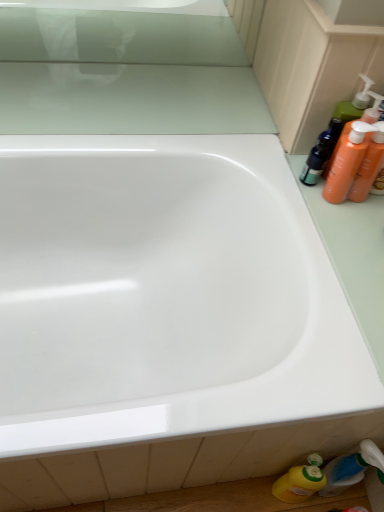
This screenshot has height=512, width=384. What are the coordinates of `yellow plastic bottle at lower right, which appears as the first cleaning product when ordered from the bottom` in the screenshot? It's located at (300, 481).

Measure the distance between white glossy bathtub at center and camera.

A distance of 59.92 centimeters exists between white glossy bathtub at center and camera.

In order to face orange plastic bottles at upper right, the 1th toiletry from the top, should I rotate leftwards or rightwards?

You should rotate right by 20.645 degrees.

The width and height of the screenshot is (384, 512). Identify the location of yellow plastic bottle at lower right, acting as the second cleaning product starting from the top. [x=300, y=481].

From a real-world perspective, is orange plastic bottles at right, positioned as the second toiletry in top-to-bottom order, located higher than translucent plastic bottle at lower right, the 1th toiletry from the bottom?

Indeed, from a real-world perspective, orange plastic bottles at right, positioned as the second toiletry in top-to-bottom order, stands above translucent plastic bottle at lower right, the 1th toiletry from the bottom.

Is point (367, 172) positioned before point (334, 476)?

Yes, point (367, 172) is in front of point (334, 476).

In the scene shown: Are orange plastic bottles at right, which ranks as the second toiletry in bottom-to-top order, and translucent plastic bottle at lower right, the 1th toiletry from the bottom, far apart?

That's not correct — orange plastic bottles at right, which ranks as the second toiletry in bottom-to-top order, is a little close to translucent plastic bottle at lower right, the 1th toiletry from the bottom.

From the image's perspective, does orange plastic bottles at right, positioned as the second toiletry in top-to-bottom order, appear lower than translucent plastic bottle at lower right, which ranks as the 3th toiletry in top-to-bottom order?

No.

Is orange plastic bottles at upper right, the third toiletry when ordered from bottom to top, facing away from orange plastic bottles at right, positioned as the second toiletry in top-to-bottom order?

No, orange plastic bottles at right, positioned as the second toiletry in top-to-bottom order, is not at the back of orange plastic bottles at upper right, the third toiletry when ordered from bottom to top.

Is orange plastic bottles at upper right, the 1th toiletry from the top, inside or outside of orange plastic bottles at right, which ranks as the second toiletry in bottom-to-top order?

orange plastic bottles at upper right, the 1th toiletry from the top, exists outside the volume of orange plastic bottles at right, which ranks as the second toiletry in bottom-to-top order.

From the picture: Relative to orange plastic bottles at right, positioned as the second toiletry in top-to-bottom order, is orange plastic bottles at upper right, the third toiletry when ordered from bottom to top, in front or behind?

orange plastic bottles at upper right, the third toiletry when ordered from bottom to top, is behind orange plastic bottles at right, positioned as the second toiletry in top-to-bottom order.

Looking at the image, does orange plastic bottles at right, positioned as the second toiletry in top-to-bottom order, seem bigger or smaller compared to yellow plastic bottle at lower right, which appears as the first cleaning product when ordered from the bottom?

orange plastic bottles at right, positioned as the second toiletry in top-to-bottom order, is smaller than yellow plastic bottle at lower right, which appears as the first cleaning product when ordered from the bottom.

Between orange plastic bottles at right, positioned as the second toiletry in top-to-bottom order, and yellow plastic bottle at lower right, which appears as the first cleaning product when ordered from the bottom, which one appears on the left side from the viewer's perspective?

yellow plastic bottle at lower right, which appears as the first cleaning product when ordered from the bottom, is more to the left.

How distant is orange plastic bottles at right, which ranks as the second toiletry in bottom-to-top order, from yellow plastic bottle at lower right, acting as the second cleaning product starting from the right?

orange plastic bottles at right, which ranks as the second toiletry in bottom-to-top order, is 25.72 inches from yellow plastic bottle at lower right, acting as the second cleaning product starting from the right.

Looking at this image, considering the relative sizes of orange plastic bottles at right, positioned as the second toiletry in top-to-bottom order, and yellow plastic bottle at lower right, acting as the second cleaning product starting from the top, in the image provided, is orange plastic bottles at right, positioned as the second toiletry in top-to-bottom order, shorter than yellow plastic bottle at lower right, acting as the second cleaning product starting from the top,?

Yes, orange plastic bottles at right, positioned as the second toiletry in top-to-bottom order, is shorter than yellow plastic bottle at lower right, acting as the second cleaning product starting from the top.

Which of these two, translucent plastic bottle at lower right, the 1th toiletry from the bottom, or white glossy bathtub at center, is thinner?

→ translucent plastic bottle at lower right, the 1th toiletry from the bottom, is thinner.

How many degrees apart are the facing directions of translucent plastic bottle at lower right, which ranks as the 3th toiletry in top-to-bottom order, and white glossy bathtub at center?

The angular difference between translucent plastic bottle at lower right, which ranks as the 3th toiletry in top-to-bottom order, and white glossy bathtub at center is 88.1 degrees.

Locate an element on the screen. the 2nd toiletry to the right of the white glossy bathtub at center, counting from the anchor's position is located at coordinates (351, 468).

From a real-world perspective, is translucent plastic bottle at lower right, which ranks as the 3th toiletry in top-to-bottom order, physically above white glossy bathtub at center?

No.

Can you tell me how much white glossy bathtub at center and orange plastic bottles at upper right, the 1th toiletry from the top, differ in facing direction?

The facing directions of white glossy bathtub at center and orange plastic bottles at upper right, the 1th toiletry from the top, are 87.4 degrees apart.

Is white glossy bathtub at center inside or outside of orange plastic bottles at upper right, the third toiletry when ordered from bottom to top?

white glossy bathtub at center exists outside the volume of orange plastic bottles at upper right, the third toiletry when ordered from bottom to top.

From a real-world perspective, is white glossy bathtub at center positioned above or below orange plastic bottles at upper right, the third toiletry when ordered from bottom to top?

Clearly, from a real-world perspective, white glossy bathtub at center is below orange plastic bottles at upper right, the third toiletry when ordered from bottom to top.

Is the depth of white glossy bathtub at center less than that of orange plastic bottles at upper right, the third toiletry when ordered from bottom to top?

Yes, the depth of white glossy bathtub at center is less than that of orange plastic bottles at upper right, the third toiletry when ordered from bottom to top.

Which object is more forward, orange plastic bottles at right, positioned as the second toiletry in top-to-bottom order, or white glossy bathtub at center?

white glossy bathtub at center.

Is orange plastic bottles at right, which ranks as the second toiletry in bottom-to-top order, oriented towards white glossy bathtub at center?

No, orange plastic bottles at right, which ranks as the second toiletry in bottom-to-top order, is not aimed at white glossy bathtub at center.

Between point (372, 162) and point (6, 261), which one is positioned in front?

The point (372, 162) is closer to the camera.

Looking at this image, between orange plastic bottles at right, which ranks as the second toiletry in bottom-to-top order, and white glossy bathtub at center, which one has larger size?

With larger size is white glossy bathtub at center.

From a real-world perspective, is orange plastic bottles at upper right, the first cleaning product positioned from the top, below orange plastic bottles at right, which ranks as the second toiletry in bottom-to-top order?

No, from a real-world perspective, orange plastic bottles at upper right, the first cleaning product positioned from the top, is not beneath orange plastic bottles at right, which ranks as the second toiletry in bottom-to-top order.

Is orange plastic bottles at upper right, marked as the 1th cleaning product in a right-to-left arrangement, taller than orange plastic bottles at right, which ranks as the second toiletry in bottom-to-top order?

Indeed, orange plastic bottles at upper right, marked as the 1th cleaning product in a right-to-left arrangement, has a greater height compared to orange plastic bottles at right, which ranks as the second toiletry in bottom-to-top order.

From the picture: Is orange plastic bottles at upper right, positioned as the 2th cleaning product in bottom-to-top order, to the left of orange plastic bottles at right, which ranks as the second toiletry in bottom-to-top order, from the viewer's perspective?

Yes.

Could you measure the distance between orange plastic bottles at upper right, the first cleaning product positioned from the top, and orange plastic bottles at right, positioned as the second toiletry in top-to-bottom order?

The distance of orange plastic bottles at upper right, the first cleaning product positioned from the top, from orange plastic bottles at right, positioned as the second toiletry in top-to-bottom order, is 1.08 inches.

Where is `the 1st toiletry above the translucent plastic bottle at lower right, the 1th toiletry from the bottom (from the image's perspective)`? the 1st toiletry above the translucent plastic bottle at lower right, the 1th toiletry from the bottom (from the image's perspective) is located at coordinates (369, 165).

This screenshot has height=512, width=384. Find the location of `the 1st toiletry in front of the orange plastic bottles at upper right, the 1th toiletry from the top`. the 1st toiletry in front of the orange plastic bottles at upper right, the 1th toiletry from the top is located at coordinates (369, 165).

When comparing their distances from white glossy bathtub at center, does orange plastic bottles at upper right, the 1th toiletry from the top, or orange plastic bottles at upper right, marked as the 1th cleaning product in a right-to-left arrangement, seem further?

orange plastic bottles at upper right, marked as the 1th cleaning product in a right-to-left arrangement, lies further to white glossy bathtub at center than the other object.

Looking at the image, which one is located closer to orange plastic bottles at upper right, the 1th toiletry from the top, orange plastic bottles at right, positioned as the second toiletry in top-to-bottom order, or translucent plastic bottle at lower right, the 1th toiletry from the bottom?

orange plastic bottles at right, positioned as the second toiletry in top-to-bottom order.

Looking at the image, which one is located further to orange plastic bottles at upper right, positioned as the 2th cleaning product in bottom-to-top order, orange plastic bottles at right, positioned as the second toiletry in top-to-bottom order, or yellow plastic bottle at lower right, which appears as the first cleaning product when ordered from the bottom?

The object further to orange plastic bottles at upper right, positioned as the 2th cleaning product in bottom-to-top order, is yellow plastic bottle at lower right, which appears as the first cleaning product when ordered from the bottom.

Looking at the image, which one is located closer to orange plastic bottles at right, which ranks as the second toiletry in bottom-to-top order, orange plastic bottles at upper right, the 1th toiletry from the top, or translucent plastic bottle at lower right, which ranks as the 3th toiletry in top-to-bottom order?

orange plastic bottles at upper right, the 1th toiletry from the top, lies closer to orange plastic bottles at right, which ranks as the second toiletry in bottom-to-top order, than the other object.

From the image, which object appears to be farther from orange plastic bottles at right, which ranks as the second toiletry in bottom-to-top order, white glossy bathtub at center or yellow plastic bottle at lower right, which appears as the first cleaning product when ordered from the bottom?

yellow plastic bottle at lower right, which appears as the first cleaning product when ordered from the bottom, lies further to orange plastic bottles at right, which ranks as the second toiletry in bottom-to-top order, than the other object.

Which object lies nearer to the anchor point white glossy bathtub at center, orange plastic bottles at right, which ranks as the second toiletry in bottom-to-top order, or translucent plastic bottle at lower right, the 1th toiletry from the bottom?

Based on the image, orange plastic bottles at right, which ranks as the second toiletry in bottom-to-top order, appears to be nearer to white glossy bathtub at center.

In the scene shown: Looking at the image, which one is located further to white glossy bathtub at center, yellow plastic bottle at lower right, which appears as the first cleaning product when ordered from the bottom, or translucent plastic bottle at lower right, which ranks as the 3th toiletry in top-to-bottom order?

translucent plastic bottle at lower right, which ranks as the 3th toiletry in top-to-bottom order, is positioned further to the anchor white glossy bathtub at center.

From the image, which object appears to be nearer to translucent plastic bottle at lower right, the 1th toiletry from the bottom, white glossy bathtub at center or orange plastic bottles at upper right, the third toiletry when ordered from bottom to top?

The object closer to translucent plastic bottle at lower right, the 1th toiletry from the bottom, is orange plastic bottles at upper right, the third toiletry when ordered from bottom to top.

The image size is (384, 512). I want to click on toiletry between orange plastic bottles at upper right, the 1th toiletry from the top, and orange plastic bottles at upper right, the first cleaning product positioned from the top, in the up-down direction, so click(x=369, y=165).

This screenshot has width=384, height=512. Identify the location of toiletry that lies between orange plastic bottles at right, positioned as the second toiletry in top-to-bottom order, and yellow plastic bottle at lower right, which appears as the first cleaning product when ordered from the bottom, from top to bottom. (351, 468).

Find the location of a particular element. bathtub between orange plastic bottles at upper right, the first cleaning product positioned from the top, and translucent plastic bottle at lower right, the 1th toiletry from the bottom, in the up-down direction is located at coordinates (164, 294).

What are the coordinates of `cleaning product between orange plastic bottles at upper right, the third toiletry when ordered from bottom to top, and yellow plastic bottle at lower right, acting as the second cleaning product starting from the right, in the vertical direction` in the screenshot? It's located at (348, 161).